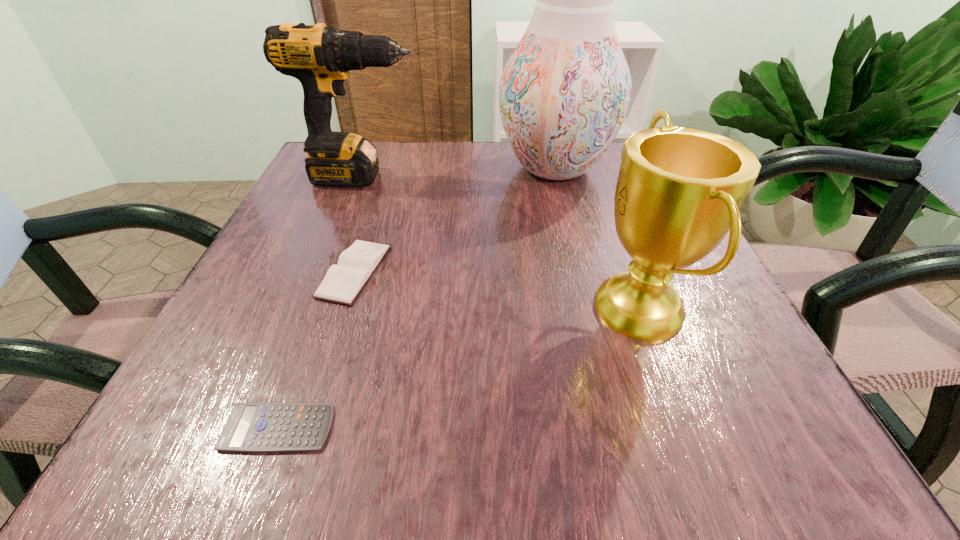
The height and width of the screenshot is (540, 960). Find the location of `vacant area between the drill and the diary`. vacant area between the drill and the diary is located at coordinates (359, 224).

Find the location of a particular element. This screenshot has height=540, width=960. free space between the vase and the award is located at coordinates (597, 239).

You are a GUI agent. You are given a task and a screenshot of the screen. Output one action in this format:
    pyautogui.click(x=<x>, y=<y>)
    Task: Click on the free space between the drill and the diary
    The height and width of the screenshot is (540, 960).
    Given the screenshot: What is the action you would take?
    359,224

At what (x,y) coordinates should I click in order to perform the action: click on free space between the award and the drill. Please return your answer as a coordinate pair (x, y). Image resolution: width=960 pixels, height=540 pixels. Looking at the image, I should click on (501, 243).

You are a GUI agent. You are given a task and a screenshot of the screen. Output one action in this format:
    pyautogui.click(x=<x>, y=<y>)
    Task: Click on the empty space between the calculator and the award
    The width and height of the screenshot is (960, 540).
    Given the screenshot: What is the action you would take?
    pyautogui.click(x=459, y=369)

The width and height of the screenshot is (960, 540). I want to click on blank region between the calculator and the drill, so click(321, 302).

Identify the location of vacant area that lies between the calculator and the vase. The width and height of the screenshot is (960, 540). (417, 298).

Where is `free spot between the drill and the shortest object`? free spot between the drill and the shortest object is located at coordinates (321, 302).

The image size is (960, 540). Identify the location of free area in between the drill and the calculator. (321, 302).

Find the location of a particular element. This screenshot has width=960, height=540. free spot between the vase and the drill is located at coordinates (459, 173).